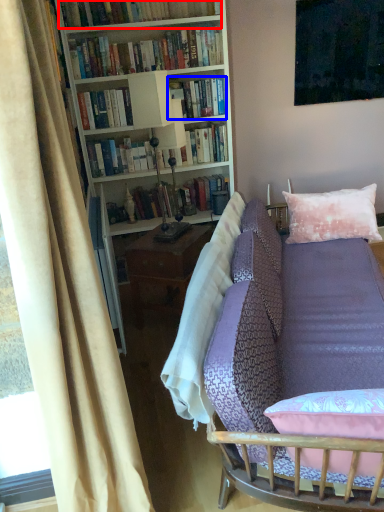
Question: Which of the following is the closest to the observer, book (highlighted by a red box) or book (highlighted by a blue box)?

Choices:
 (A) book
 (B) book

Answer: (A)